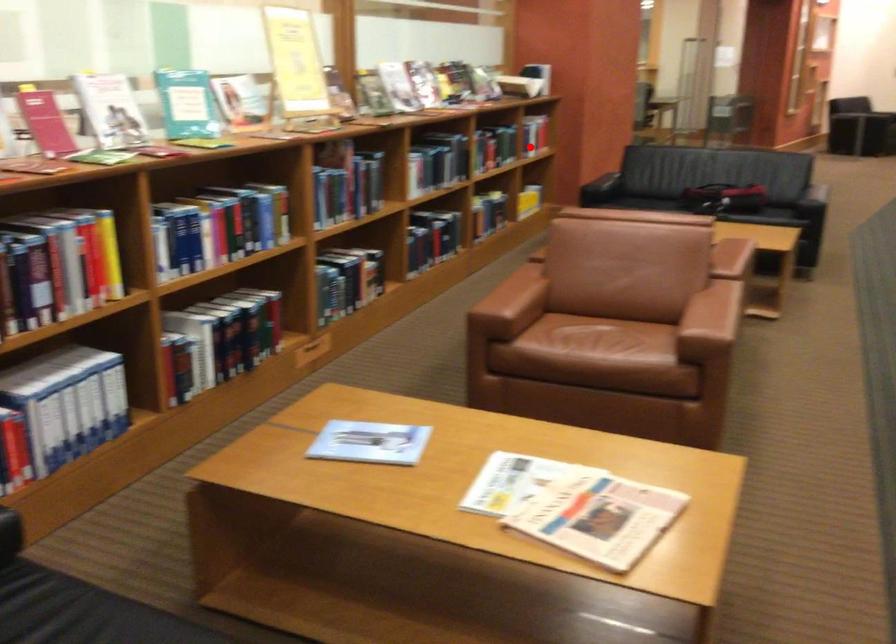
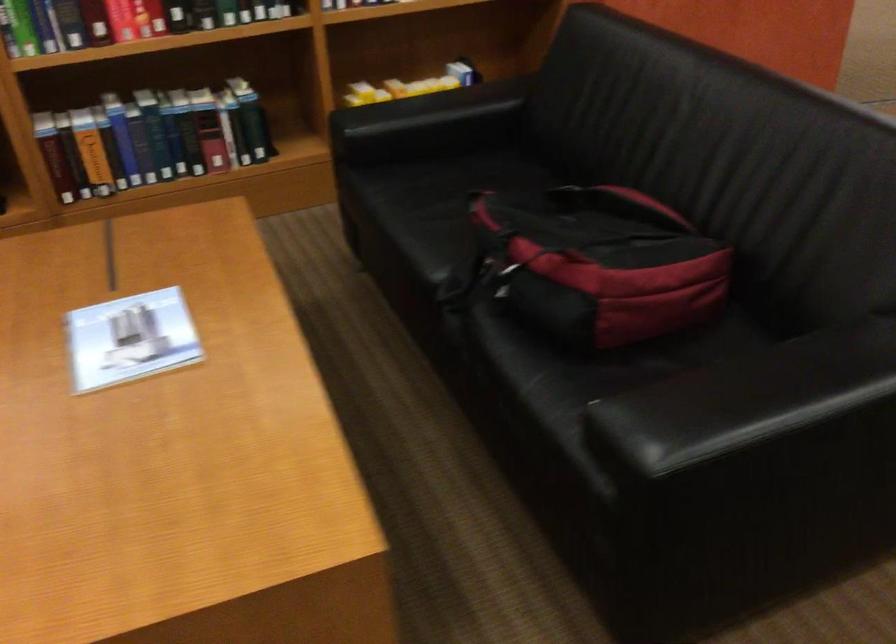
Locate, in the second image, the point that corresponds to the highlighted location in the first image.

(350, 3)